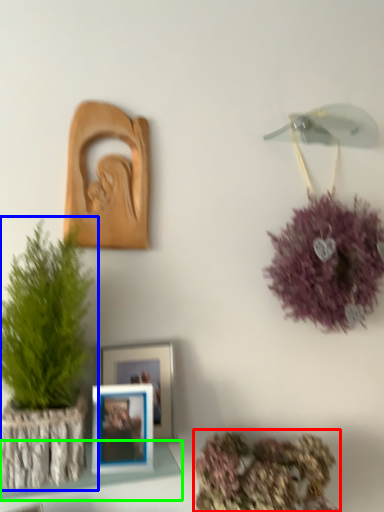
Question: Estimate the real-world distances between objects in this image. Which object is closer to floral arrangement (highlighted by a red box), houseplant (highlighted by a blue box) or shelf (highlighted by a green box)?

Choices:
 (A) houseplant
 (B) shelf

Answer: (B)